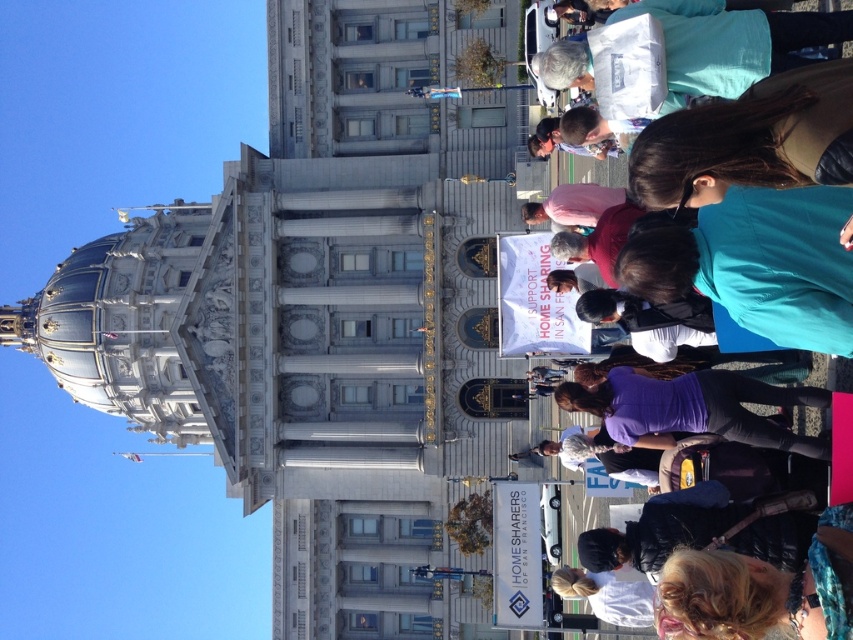
Question: Can you confirm if teal fabric crowd at right is positioned to the right of blue fabric sign at upper center?

Choices:
 (A) no
 (B) yes

Answer: (B)

Question: Is the position of purple fabric at center less distant than that of blue fabric sign at upper center?

Choices:
 (A) no
 (B) yes

Answer: (B)

Question: Is white marble tower at center behind teal fabric crowd at right?

Choices:
 (A) no
 (B) yes

Answer: (B)

Question: Which point is farther to the camera?

Choices:
 (A) teal fabric crowd at right
 (B) purple fabric at center

Answer: (A)

Question: Considering the real-world distances, which object is farthest from the teal fabric crowd at right?

Choices:
 (A) blue fabric sign at upper center
 (B) white marble tower at center

Answer: (B)

Question: Which of the following is the closest to the observer?

Choices:
 (A) (791, 438)
 (B) (827, 356)
 (C) (468, 312)

Answer: (A)